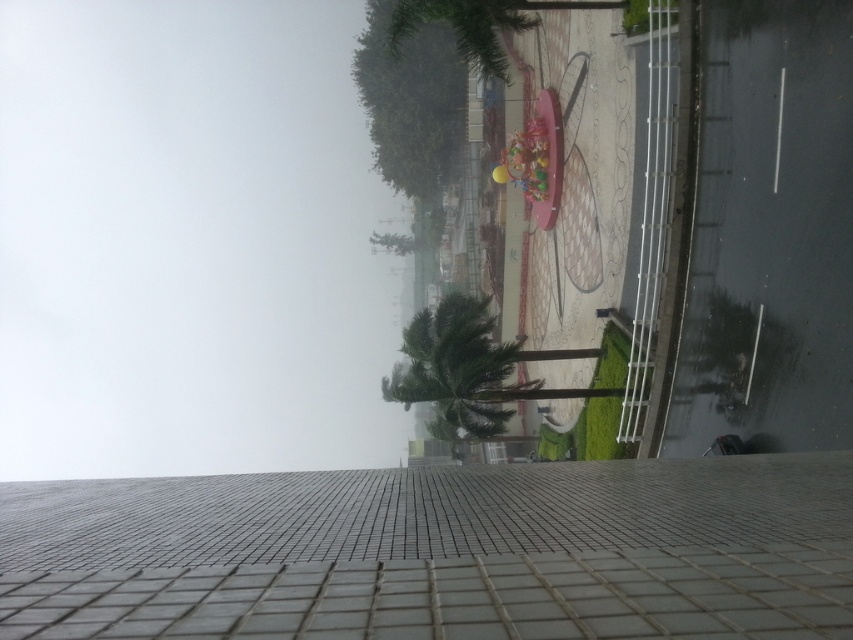
Is white fog at upper left to the left of green leafy palm tree at center from the viewer's perspective?

Correct, you'll find white fog at upper left to the left of green leafy palm tree at center.

Where is `white fog at upper left`? The image size is (853, 640). white fog at upper left is located at coordinates (190, 241).

Can you confirm if white fog at upper left is smaller than gray tile pavement at center?

Actually, white fog at upper left might be larger than gray tile pavement at center.

Which of these two, white fog at upper left or gray tile pavement at center, stands taller?

With more height is white fog at upper left.

Image resolution: width=853 pixels, height=640 pixels. In order to click on white fog at upper left in this screenshot , I will do `click(190, 241)`.

Does gray tile pavement at center have a lesser width compared to green leafy palm tree at center?

No.

Does gray tile pavement at center have a greater height compared to green leafy palm tree at center?

No, gray tile pavement at center is not taller than green leafy palm tree at center.

Between point (718, 472) and point (398, 368), which one is positioned in front?

Point (718, 472) is in front.

Find the location of a particular element. The width and height of the screenshot is (853, 640). gray tile pavement at center is located at coordinates (437, 552).